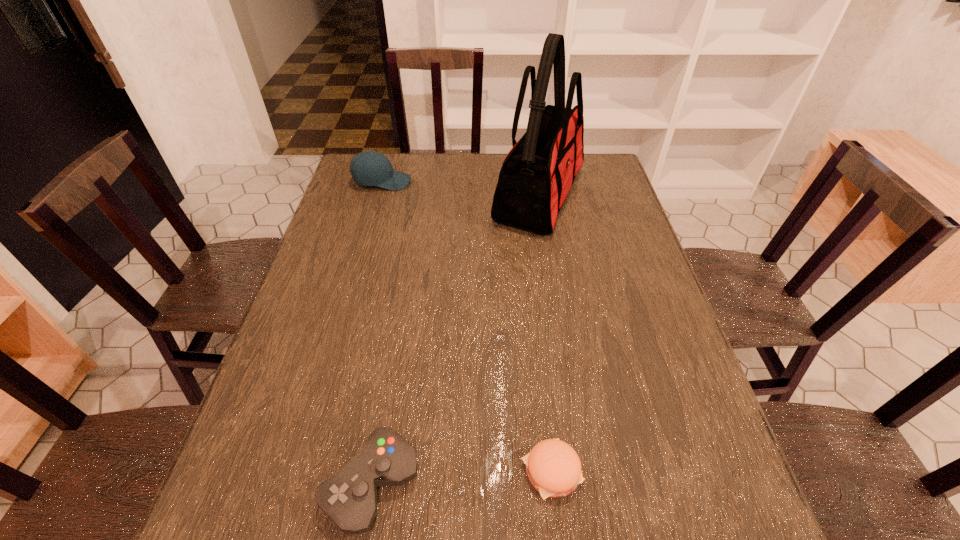
Identify the location of object present at the near edge. (349, 498).

Where is `object at the left edge`? The height and width of the screenshot is (540, 960). object at the left edge is located at coordinates (369, 168).

This screenshot has height=540, width=960. Find the location of `object that is at the right edge`. object that is at the right edge is located at coordinates (537, 173).

You are a GUI agent. You are given a task and a screenshot of the screen. Output one action in this format:
    pyautogui.click(x=<x>, y=<y>)
    Task: Click on the object that is at the far left corner
    The width and height of the screenshot is (960, 540).
    Given the screenshot: What is the action you would take?
    pyautogui.click(x=369, y=168)

You are a GUI agent. You are given a task and a screenshot of the screen. Output one action in this format:
    pyautogui.click(x=<x>, y=<y>)
    Task: Click on the object situated at the far right corner
    This screenshot has height=540, width=960.
    Given the screenshot: What is the action you would take?
    pyautogui.click(x=537, y=173)

What are the coordinates of `blank area at the near edge` in the screenshot? It's located at (492, 536).

Image resolution: width=960 pixels, height=540 pixels. I want to click on vacant region at the left edge of the desktop, so click(x=243, y=482).

The height and width of the screenshot is (540, 960). I want to click on blank area at the right edge, so click(578, 199).

Locate an element on the screen. Image resolution: width=960 pixels, height=540 pixels. vacant space at the far left corner is located at coordinates (348, 169).

The image size is (960, 540). In order to click on vacant space at the far right corner in this screenshot , I will do `click(612, 188)`.